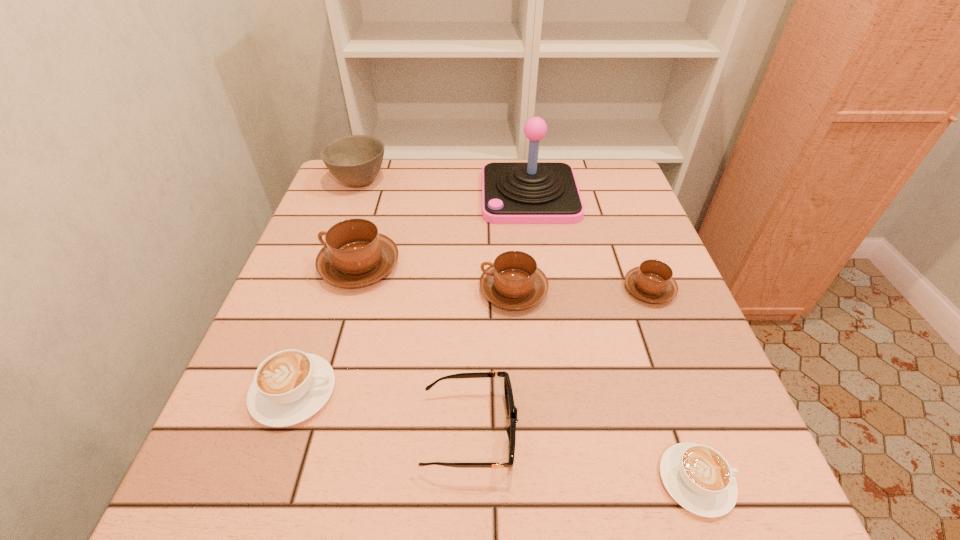
Find the location of `joystick`. joystick is located at coordinates (532, 192).

What are the coordinates of `the tallest object` in the screenshot? It's located at tap(532, 192).

The height and width of the screenshot is (540, 960). In order to click on bowl in this screenshot , I will do `click(355, 160)`.

This screenshot has width=960, height=540. In order to click on the biggest brown cappuccino in this screenshot , I will do `click(355, 254)`.

The height and width of the screenshot is (540, 960). Find the location of `the tallest cappuccino`. the tallest cappuccino is located at coordinates (355, 254).

Where is `the second tallest cappuccino`? The height and width of the screenshot is (540, 960). the second tallest cappuccino is located at coordinates (513, 281).

I want to click on the second biggest brown cappuccino, so click(x=513, y=281).

Find the location of `the fourth farthest cappuccino`. the fourth farthest cappuccino is located at coordinates (290, 386).

The image size is (960, 540). I want to click on the farther white cappuccino, so click(290, 386).

This screenshot has height=540, width=960. Find the location of `the rightmost brown cappuccino`. the rightmost brown cappuccino is located at coordinates (652, 281).